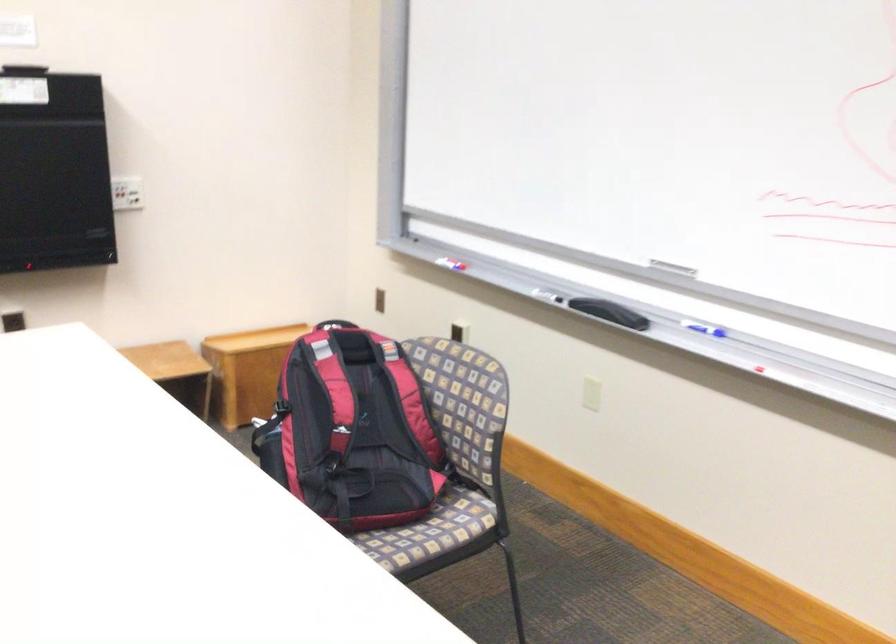
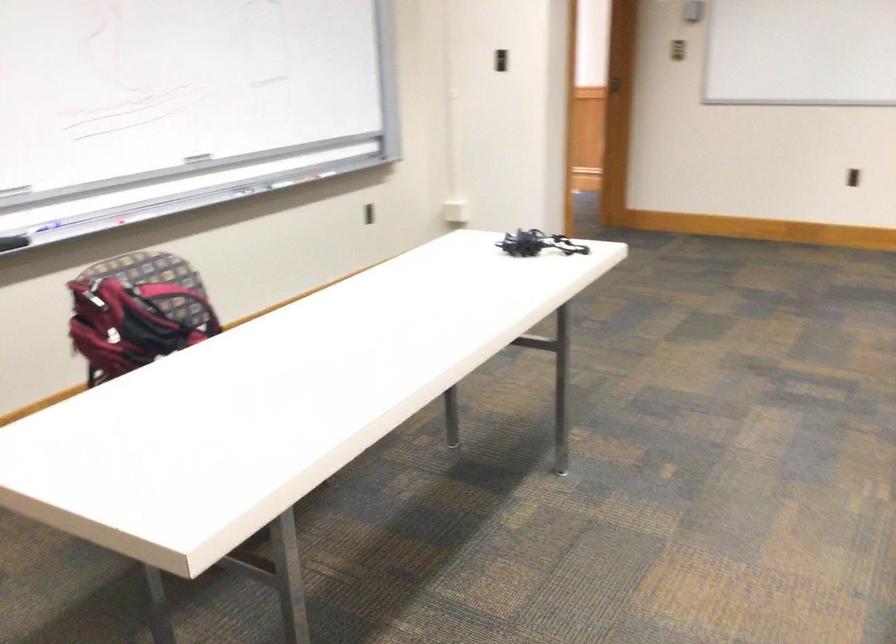
Locate, in the second image, the point that corresponds to (x=480, y=438) in the first image.

(177, 301)